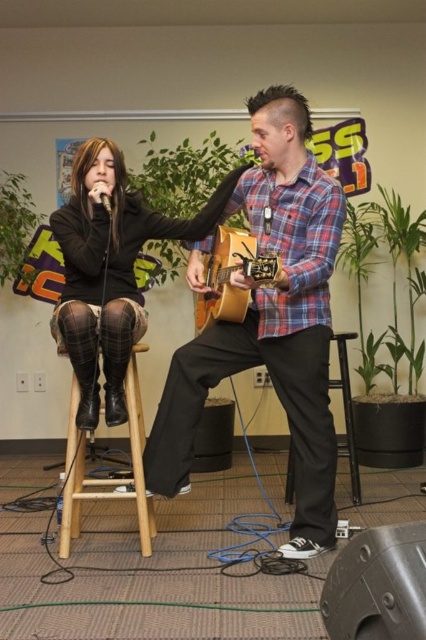
Question: Does wooden stool at left come in front of black fabric stool at lower center?

Choices:
 (A) yes
 (B) no

Answer: (A)

Question: Which object appears farthest from the camera in this image?

Choices:
 (A) acoustic wood guitar at center
 (B) black fabric stool at lower center

Answer: (B)

Question: Which object appears farthest from the camera in this image?

Choices:
 (A) plaid fabric guitar at center
 (B) black fabric stool at lower center

Answer: (B)

Question: Can you confirm if plaid fabric skirt at center is positioned to the left of black fabric stool at lower center?

Choices:
 (A) no
 (B) yes

Answer: (B)

Question: Is acoustic wood guitar at center wider than brown plaid fabric chair at center?

Choices:
 (A) no
 (B) yes

Answer: (A)

Question: Which point is farther to the camera?

Choices:
 (A) acoustic wood guitar at center
 (B) brown plaid fabric chair at center
 (C) wooden stool at left

Answer: (B)